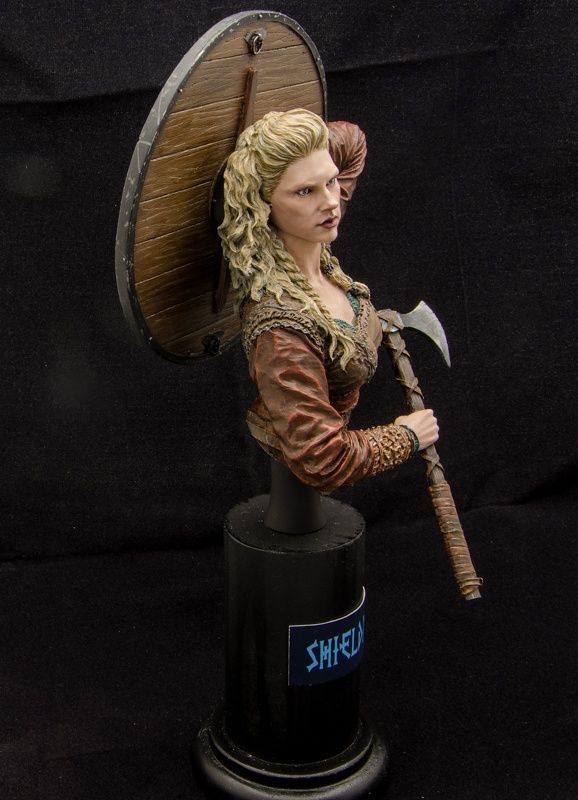
Find the location of a particular element. Image resolution: width=578 pixels, height=800 pixels. figurine is located at coordinates (299, 381).